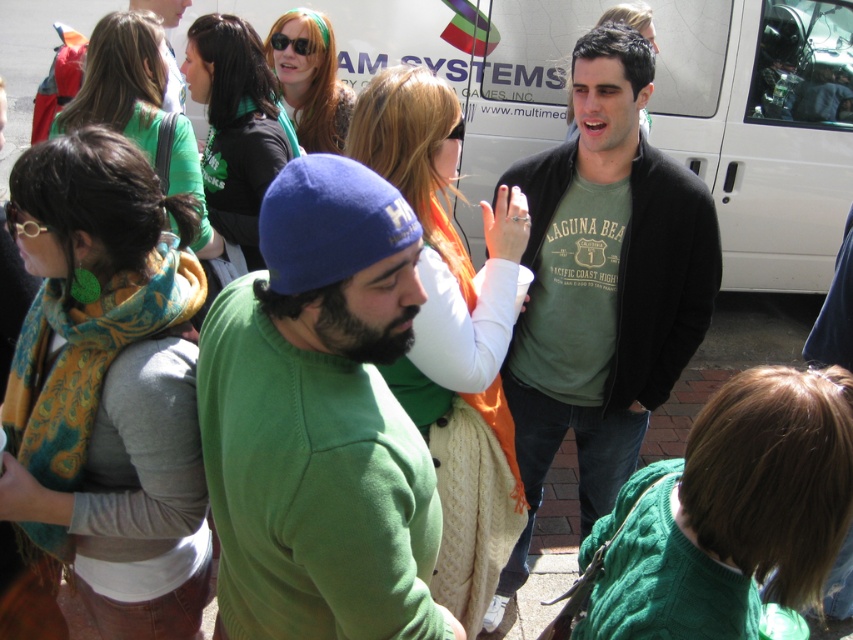
You are at an event and want to take a photo of the green matte sweatshirt at center without the white matte van at upper center blocking the view. Is the van positioned in a way that it might obstruct the shot?

The white matte van at upper center is above the green matte sweatshirt at center, so it may obstruct the view of the sweatshirt unless you move lower or angle your camera downward.

You are a photographer standing in the crowd and want to capture both the green fleece beanie at center and the white matte van at upper center in a single photo. Based on their distance apart, do you think you can fit both into your camera frame without moving your position?

The green fleece beanie at center and the white matte van at upper center are 3.98 meters apart. Depending on the camera lens and zoom settings, it might be possible to capture both in one frame without moving. However, the exact feasibility depends on the camera specifications and the photographer s current positioning.